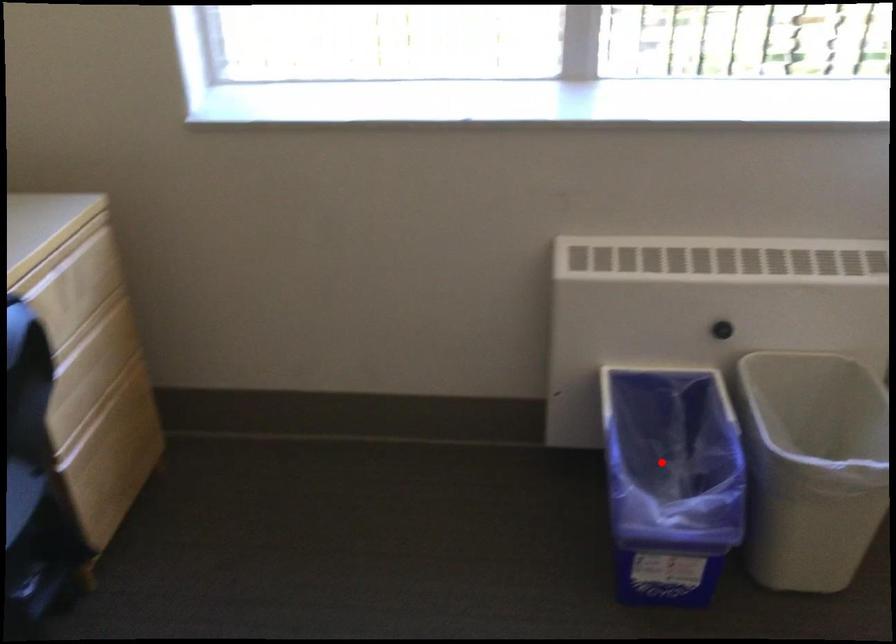
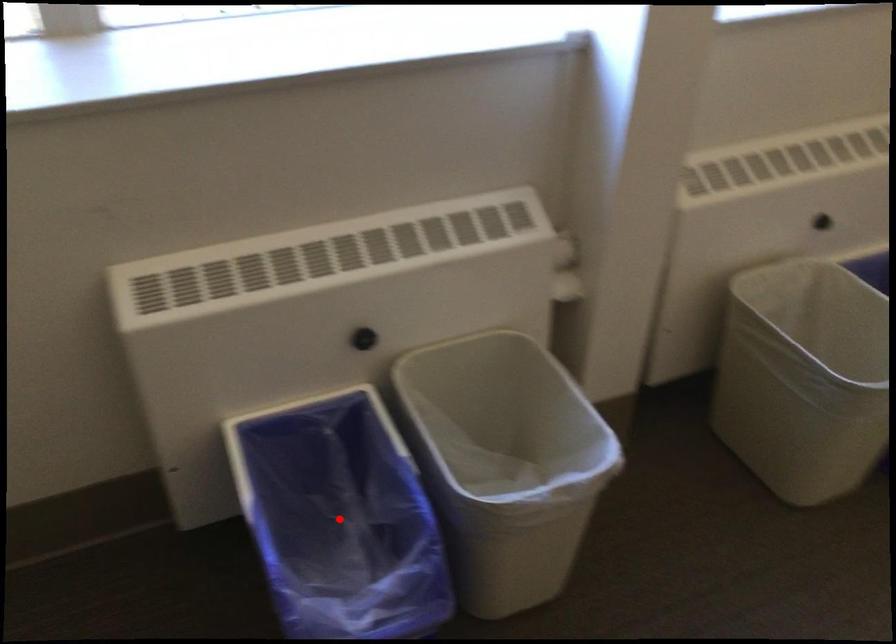
I am providing you with two images of the same scene from different viewpoints. A red point is marked on the first image and another point is marked on the second image. Is the marked point in image1 the same physical position as the marked point in image2?

Yes